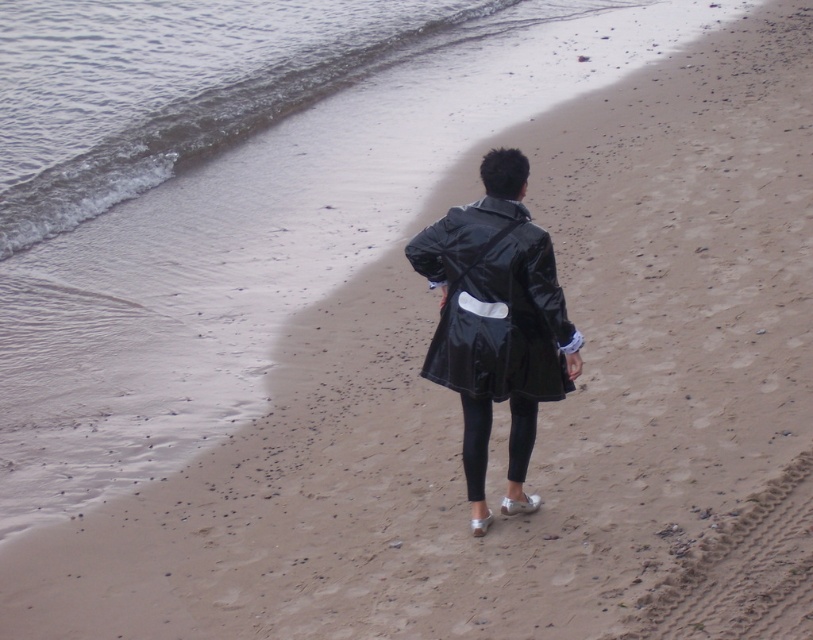
Question: Can you confirm if glossy water at upper left is wider than glossy black coat at center?

Choices:
 (A) yes
 (B) no

Answer: (A)

Question: Can you confirm if glossy water at upper left is positioned below glossy black coat at center?

Choices:
 (A) yes
 (B) no

Answer: (B)

Question: Which point is closer to the camera taking this photo?

Choices:
 (A) (450, 262)
 (B) (370, 17)

Answer: (A)

Question: Does glossy water at upper left have a lesser width compared to glossy black coat at center?

Choices:
 (A) yes
 (B) no

Answer: (B)

Question: Among these objects, which one is nearest to the camera?

Choices:
 (A) glossy water at upper left
 (B) glossy black coat at center

Answer: (B)